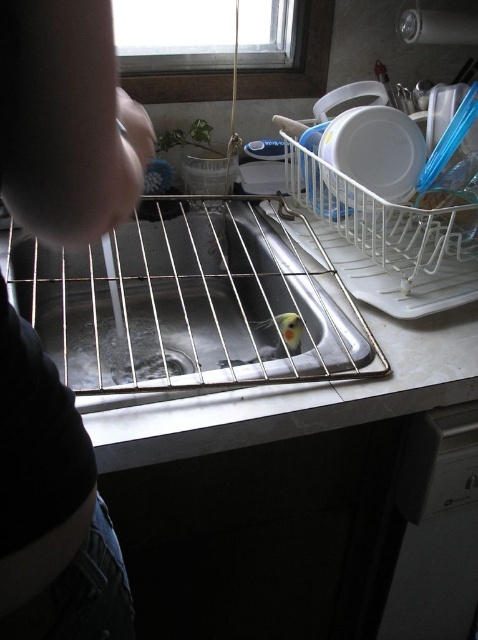
Does point (79, 120) lie in front of point (133, 230)?

Yes, it is.

Is dark fabric shirt at left closer to camera compared to stainless steel sink at center?

Yes.

Between point (110, 141) and point (304, 301), which one is positioned in front?

Point (110, 141) is more forward.

Where is `dark fabric shirt at left`? This screenshot has height=640, width=478. dark fabric shirt at left is located at coordinates (51, 506).

Is dark fabric shirt at left further to the viewer compared to yellow-green parrot at sink center?

No.

Is dark fabric shirt at left positioned before yellow-green parrot at sink center?

Yes, dark fabric shirt at left is closer to the viewer.

Does point (106, 618) come in front of point (231, 362)?

That is True.

Find the location of a particular element. Image resolution: width=478 pixels, height=640 pixels. dark fabric shirt at left is located at coordinates (51, 506).

Does dark fabric shirt at left have a smaller size compared to white plastic dishwasher at lower right?

Indeed, dark fabric shirt at left has a smaller size compared to white plastic dishwasher at lower right.

Who is positioned more to the left, dark fabric shirt at left or white plastic dishwasher at lower right?

dark fabric shirt at left is more to the left.

Identify the location of dark fabric shirt at left. The height and width of the screenshot is (640, 478). (51, 506).